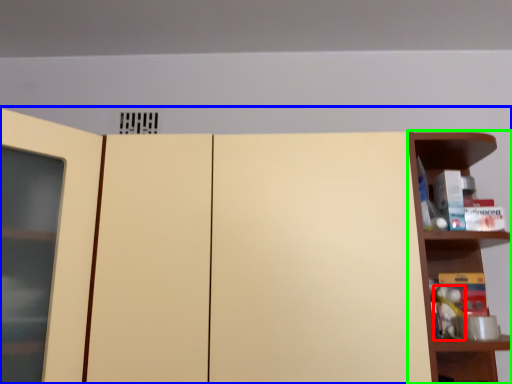
Question: Which is nearer to the toy (highlighted by a red box)? cupboard (highlighted by a blue box) or shelf (highlighted by a green box).

Choices:
 (A) cupboard
 (B) shelf

Answer: (B)